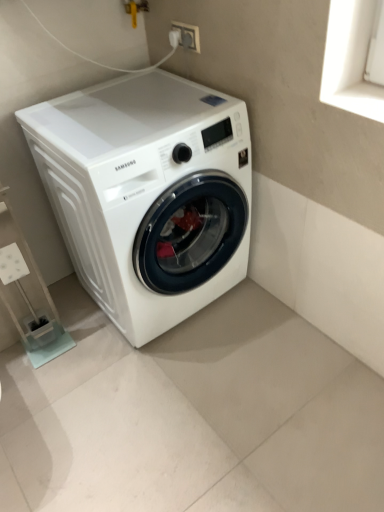
Question: Is white plastic shelf at lower left facing away from white glossy washing machine at center?

Choices:
 (A) yes
 (B) no

Answer: (B)

Question: From a real-world perspective, is white plastic shelf at lower left under white glossy washing machine at center?

Choices:
 (A) no
 (B) yes

Answer: (B)

Question: From the image's perspective, would you say white plastic shelf at lower left is shown under white glossy washing machine at center?

Choices:
 (A) no
 (B) yes

Answer: (B)

Question: Can you confirm if white plastic shelf at lower left is wider than white glossy washing machine at center?

Choices:
 (A) yes
 (B) no

Answer: (B)

Question: Is white plastic shelf at lower left beside white glossy washing machine at center?

Choices:
 (A) no
 (B) yes

Answer: (A)

Question: From a real-world perspective, is white plastic shelf at lower left over white glossy washing machine at center?

Choices:
 (A) no
 (B) yes

Answer: (A)

Question: From the image's perspective, is white plastic shelf at lower left on top of white plastic socket at upper center?

Choices:
 (A) yes
 (B) no

Answer: (B)

Question: Considering the relative sizes of white plastic shelf at lower left and white plastic socket at upper center in the image provided, is white plastic shelf at lower left smaller than white plastic socket at upper center?

Choices:
 (A) yes
 (B) no

Answer: (B)

Question: Does white plastic shelf at lower left have a larger size compared to white plastic socket at upper center?

Choices:
 (A) no
 (B) yes

Answer: (B)

Question: Are white plastic shelf at lower left and white plastic socket at upper center located far from each other?

Choices:
 (A) no
 (B) yes

Answer: (B)

Question: Is white plastic shelf at lower left located outside white plastic socket at upper center?

Choices:
 (A) yes
 (B) no

Answer: (A)

Question: From a real-world perspective, is white plastic shelf at lower left located beneath white plastic socket at upper center?

Choices:
 (A) yes
 (B) no

Answer: (A)

Question: Can you confirm if white glossy washing machine at center is smaller than white plastic shelf at lower left?

Choices:
 (A) no
 (B) yes

Answer: (A)